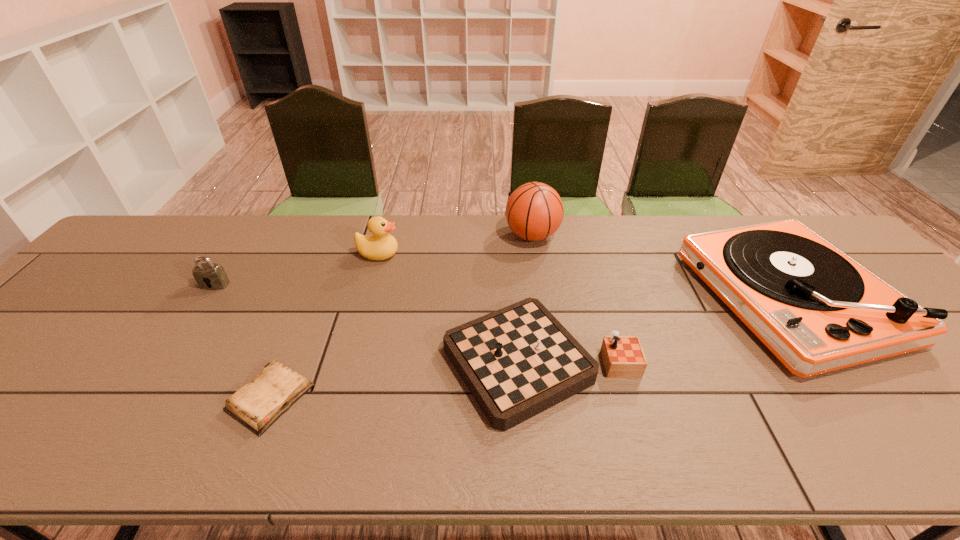
Locate an element on the screen. This screenshot has width=960, height=540. free space between the padlock and the chessboard is located at coordinates (377, 324).

Image resolution: width=960 pixels, height=540 pixels. Find the location of `free space between the tallest object and the diary`. free space between the tallest object and the diary is located at coordinates (401, 317).

Identify which object is the third closest to the duck. Please provide its 2D coordinates. Your answer should be formatted as a tuple, i.e. [(x, y)], where the tuple contains the x and y coordinates of a point satisfying the conditions above.

[(209, 276)]

Select which object is the third closest to the fifth tallest object. Please provide its 2D coordinates. Your answer should be formatted as a tuple, i.e. [(x, y)], where the tuple contains the x and y coordinates of a point satisfying the conditions above.

[(381, 245)]

Find the location of a particular element. vacant space that satisfies the following two spatial constraints: 1. at the front of the leftmost object near the keyhole; 2. on the left side of the chessboard is located at coordinates (162, 363).

Locate an element on the screen. This screenshot has height=540, width=960. free spot that satisfies the following two spatial constraints: 1. at the front of the padlock near the keyhole; 2. on the right side of the fifth tallest object is located at coordinates [x=162, y=363].